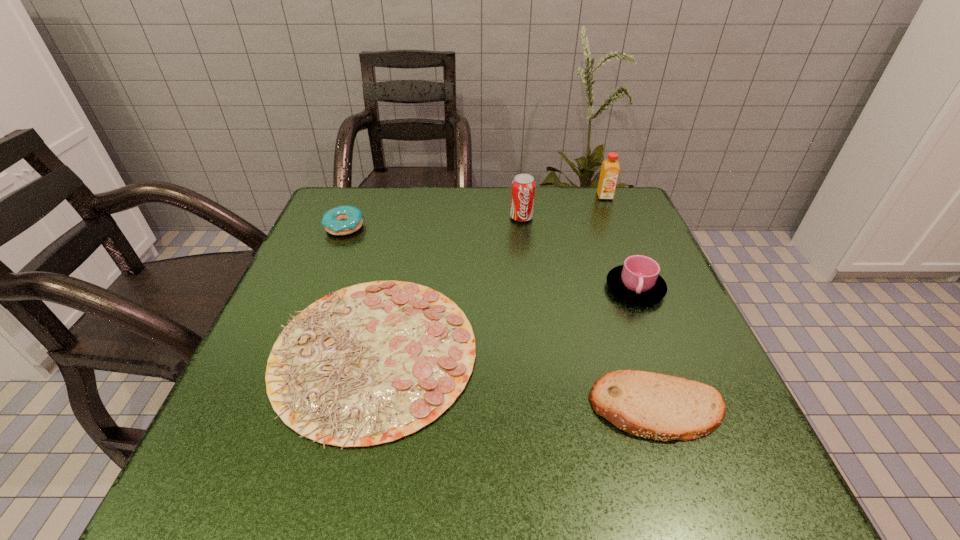
Image resolution: width=960 pixels, height=540 pixels. In order to click on cup located at the right edge in this screenshot , I will do `click(638, 280)`.

At what (x,y) coordinates should I click in order to perform the action: click on pita bread that is at the right edge. Please return your answer as a coordinate pair (x, y). Image resolution: width=960 pixels, height=540 pixels. Looking at the image, I should click on (656, 406).

At what (x,y) coordinates should I click in order to perform the action: click on object that is at the far left corner. Please return your answer as a coordinate pair (x, y). The height and width of the screenshot is (540, 960). Looking at the image, I should click on (343, 220).

The height and width of the screenshot is (540, 960). I want to click on object at the near left corner, so click(368, 364).

What are the coordinates of `object located at the far right corner` in the screenshot? It's located at (610, 168).

You are a GUI agent. You are given a task and a screenshot of the screen. Output one action in this format:
    pyautogui.click(x=<x>, y=<y>)
    Task: Click on the object that is positioned at the near right corner
    The image size is (960, 540).
    Given the screenshot: What is the action you would take?
    pyautogui.click(x=656, y=406)

In the image, there is a desktop. Where is `vacant space at the far edge`? This screenshot has width=960, height=540. vacant space at the far edge is located at coordinates (462, 224).

Where is `vacant region at the near edge of the desktop`? vacant region at the near edge of the desktop is located at coordinates (585, 453).

Image resolution: width=960 pixels, height=540 pixels. In the image, there is a desktop. Find the location of `free space at the left edge`. free space at the left edge is located at coordinates (322, 287).

In the image, there is a desktop. Where is `vacant area at the right edge`? This screenshot has width=960, height=540. vacant area at the right edge is located at coordinates (592, 270).